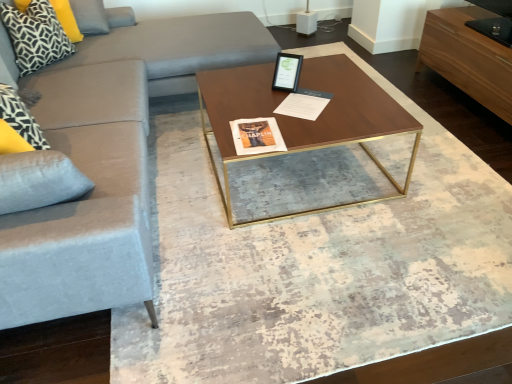
Identify the location of free space in front of white paper at center. Image resolution: width=512 pixels, height=384 pixels. (309, 122).